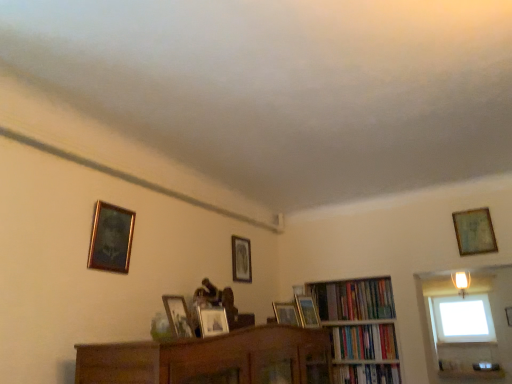
Question: Is wooden picture frame at center, positioned as the fourth picture frame in back-to-front order, completely or partially outside of wooden photo frame at center, marked as the 1th picture frame in a front-to-back arrangement?

Choices:
 (A) yes
 (B) no

Answer: (A)

Question: Does wooden picture frame at center, arranged as the 4th picture frame when viewed from the left, have a greater height compared to wooden photo frame at center, which is counted as the fifth picture frame, starting from the right?

Choices:
 (A) no
 (B) yes

Answer: (A)

Question: Does wooden picture frame at center, positioned as the fourth picture frame in back-to-front order, have a greater width compared to wooden photo frame at center, which is counted as the fifth picture frame, starting from the right?

Choices:
 (A) yes
 (B) no

Answer: (B)

Question: Is wooden picture frame at center, which appears as the 3th picture frame when viewed from the front, not close to wooden photo frame at center, the second picture frame when ordered from left to right?

Choices:
 (A) no
 (B) yes

Answer: (A)

Question: Is wooden picture frame at center, which appears as the 3th picture frame when viewed from the front, looking in the opposite direction of wooden photo frame at center, the second picture frame when ordered from left to right?

Choices:
 (A) yes
 (B) no

Answer: (B)

Question: Is point (287, 322) positioned closer to the camera than point (458, 244)?

Choices:
 (A) closer
 (B) farther

Answer: (A)

Question: Considering the positions of wooden picture frame at center, arranged as the 4th picture frame when viewed from the left, and wooden picture frame at upper right, the 5th picture frame viewed from the front, in the image, is wooden picture frame at center, arranged as the 4th picture frame when viewed from the left, taller or shorter than wooden picture frame at upper right, the 5th picture frame viewed from the front,?

Choices:
 (A) short
 (B) tall

Answer: (A)

Question: Is wooden picture frame at center, which ranks as the 3th picture frame in right-to-left order, wider or thinner than wooden picture frame at upper right, acting as the sixth picture frame starting from the left?

Choices:
 (A) thin
 (B) wide

Answer: (B)

Question: From a real-world perspective, is wooden picture frame at center, which ranks as the 3th picture frame in right-to-left order, physically located above or below wooden picture frame at upper right, the 1th picture frame viewed from the right?

Choices:
 (A) above
 (B) below

Answer: (B)

Question: Is transparent glass window at upper right wider or thinner than wooden photo frame at center, which is the sixth picture frame in back-to-front order?

Choices:
 (A) thin
 (B) wide

Answer: (B)

Question: From the image's perspective, is transparent glass window at upper right positioned above or below wooden photo frame at center, which is the sixth picture frame in back-to-front order?

Choices:
 (A) below
 (B) above

Answer: (A)

Question: Is transparent glass window at upper right inside or outside of wooden photo frame at center, which is the sixth picture frame in back-to-front order?

Choices:
 (A) inside
 (B) outside

Answer: (B)

Question: From their relative heights in the image, would you say transparent glass window at upper right is taller or shorter than wooden photo frame at center, the second picture frame when ordered from left to right?

Choices:
 (A) short
 (B) tall

Answer: (B)

Question: Is hardcover book at center-right, which ranks as the 3th book in top-to-bottom order, spatially inside gold-framed painting at upper left, marked as the first picture frame in a left-to-right arrangement, or outside of it?

Choices:
 (A) inside
 (B) outside

Answer: (B)

Question: Considering the positions of hardcover book at center-right, which ranks as the 3th book in top-to-bottom order, and gold-framed painting at upper left, the sixth picture frame viewed from the right, in the image, is hardcover book at center-right, which ranks as the 3th book in top-to-bottom order, taller or shorter than gold-framed painting at upper left, the sixth picture frame viewed from the right,?

Choices:
 (A) short
 (B) tall

Answer: (A)